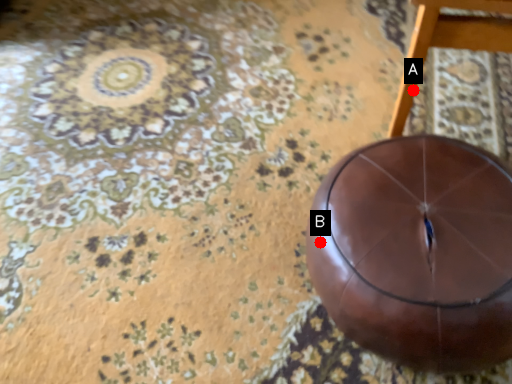
Question: Two points are circled on the image, labeled by A and B beside each circle. Which point appears farthest from the camera in this image?

Choices:
 (A) A is further
 (B) B is further

Answer: (A)